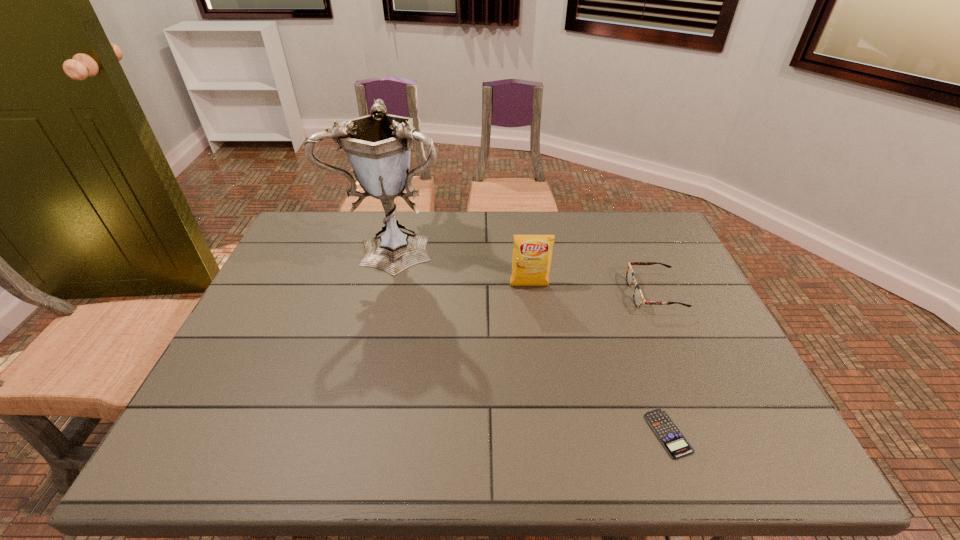
The width and height of the screenshot is (960, 540). What are the coordinates of `vacant space that's between the spectacles and the nearest object` in the screenshot? It's located at (661, 363).

Locate which object ranks third in proximity to the third tallest object. Please provide its 2D coordinates. Your answer should be formatted as a tuple, i.e. [(x, y)], where the tuple contains the x and y coordinates of a point satisfying the conditions above.

[(378, 146)]

This screenshot has height=540, width=960. I want to click on object that stands as the third closest to the crisp (potato chip), so click(x=672, y=439).

This screenshot has width=960, height=540. Identify the location of vacant space that satisfies the following two spatial constraints: 1. on the front side of the calculator; 2. on the left side of the tallest object. (351, 434).

At what (x,y) coordinates should I click in order to perform the action: click on free space that satisfies the following two spatial constraints: 1. on the front side of the nearest object; 2. on the right side of the leftmost object. Please return your answer as a coordinate pair (x, y). Image resolution: width=960 pixels, height=540 pixels. Looking at the image, I should click on (351, 434).

Image resolution: width=960 pixels, height=540 pixels. I want to click on vacant space that satisfies the following two spatial constraints: 1. on the front of the crisp (potato chip) with the logo; 2. on the left side of the nearest object, so click(x=548, y=434).